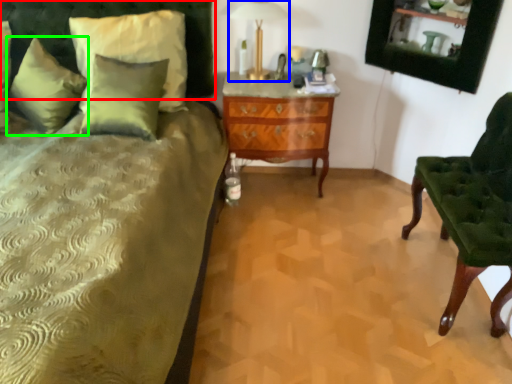
Question: Which is nearer to the headboard (highlighted by a red box)? table lamp (highlighted by a blue box) or pillow (highlighted by a green box).

Choices:
 (A) table lamp
 (B) pillow

Answer: (B)